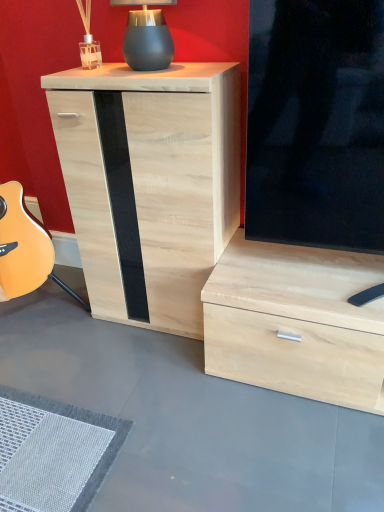
Question: In terms of size, does natural wood cabinet at center appear bigger or smaller than matte black lamp at upper center?

Choices:
 (A) small
 (B) big

Answer: (B)

Question: Is point (87, 259) positioned closer to the camera than point (158, 22)?

Choices:
 (A) closer
 (B) farther

Answer: (B)

Question: Based on their positions, is natural wood cabinet at center located to the left or right of matte black lamp at upper center?

Choices:
 (A) left
 (B) right

Answer: (B)

Question: Considering the relative positions of matte black lamp at upper center and natural wood cabinet at center in the image provided, is matte black lamp at upper center to the left or to the right of natural wood cabinet at center?

Choices:
 (A) left
 (B) right

Answer: (A)

Question: Considering the positions of point pyautogui.click(x=147, y=29) and point pyautogui.click(x=132, y=82), is point pyautogui.click(x=147, y=29) closer or farther from the camera than point pyautogui.click(x=132, y=82)?

Choices:
 (A) farther
 (B) closer

Answer: (A)

Question: From a real-world perspective, relative to natural wood cabinet at center, is matte black lamp at upper center vertically above or below?

Choices:
 (A) below
 (B) above

Answer: (B)

Question: Looking at their shapes, would you say matte black lamp at upper center is wider or thinner than natural wood cabinet at center?

Choices:
 (A) thin
 (B) wide

Answer: (A)